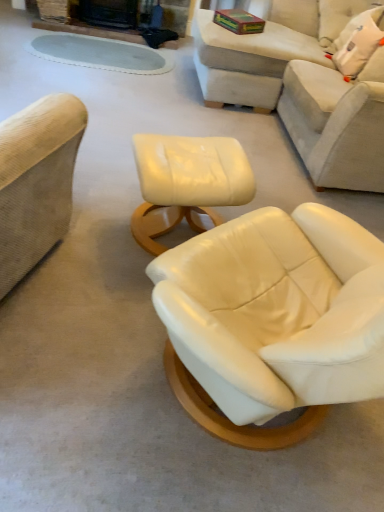
Question: Can you confirm if matte cream ottoman at center is bigger than white fabric pillow at upper right?

Choices:
 (A) no
 (B) yes

Answer: (B)

Question: From a real-world perspective, is matte cream ottoman at center positioned over white fabric pillow at upper right based on gravity?

Choices:
 (A) yes
 (B) no

Answer: (B)

Question: Is matte cream ottoman at center located outside white fabric pillow at upper right?

Choices:
 (A) no
 (B) yes

Answer: (B)

Question: Is matte cream ottoman at center shorter than white fabric pillow at upper right?

Choices:
 (A) no
 (B) yes

Answer: (A)

Question: Does matte cream ottoman at center come behind white fabric pillow at upper right?

Choices:
 (A) yes
 (B) no

Answer: (B)

Question: Considering the relative positions of beige leather couch at upper right and white fabric pillow at upper right in the image provided, is beige leather couch at upper right to the left or to the right of white fabric pillow at upper right?

Choices:
 (A) right
 (B) left

Answer: (B)

Question: Looking at the image, does beige leather couch at upper right seem bigger or smaller compared to white fabric pillow at upper right?

Choices:
 (A) small
 (B) big

Answer: (B)

Question: Considering the positions of beige leather couch at upper right and white fabric pillow at upper right in the image, is beige leather couch at upper right taller or shorter than white fabric pillow at upper right?

Choices:
 (A) tall
 (B) short

Answer: (A)

Question: From a real-world perspective, is beige leather couch at upper right positioned above or below white fabric pillow at upper right?

Choices:
 (A) below
 (B) above

Answer: (A)

Question: Is beige leather couch at upper right to the left or to the right of matte cream ottoman at center in the image?

Choices:
 (A) right
 (B) left

Answer: (A)

Question: Is beige leather couch at upper right taller or shorter than matte cream ottoman at center?

Choices:
 (A) short
 (B) tall

Answer: (B)

Question: Is beige leather couch at upper right wider or thinner than matte cream ottoman at center?

Choices:
 (A) thin
 (B) wide

Answer: (B)

Question: Considering the positions of beige leather couch at upper right and matte cream ottoman at center in the image, is beige leather couch at upper right bigger or smaller than matte cream ottoman at center?

Choices:
 (A) small
 (B) big

Answer: (B)

Question: In terms of width, does beige leather couch at upper right look wider or thinner when compared to beige leather couch at upper right?

Choices:
 (A) thin
 (B) wide

Answer: (A)

Question: Is beige leather couch at upper right in front of or behind beige leather couch at upper right in the image?

Choices:
 (A) front
 (B) behind

Answer: (B)